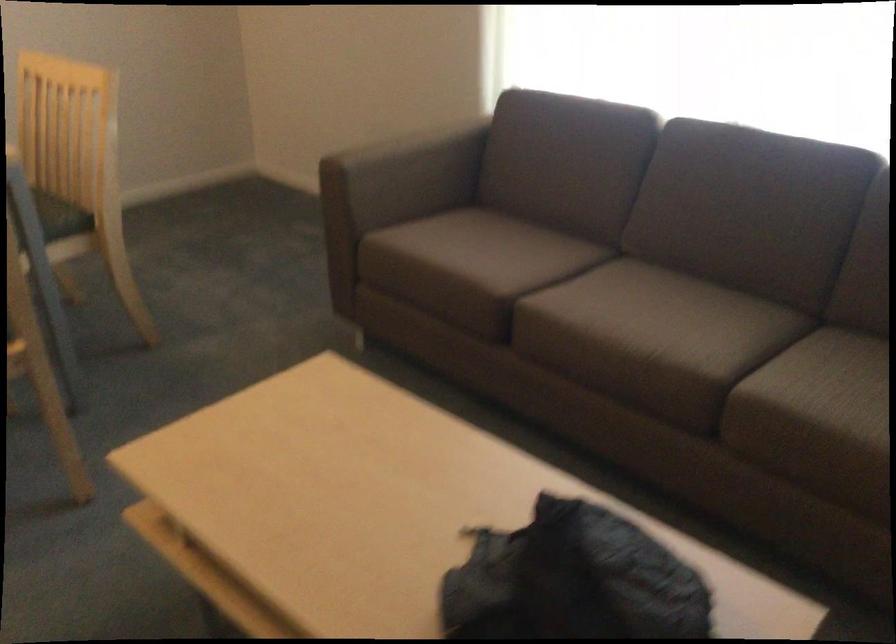
At what (x,y) coordinates should I click in order to perform the action: click on sofa armrest. Please return your answer as a coordinate pair (x, y). The image size is (896, 644). Looking at the image, I should click on (403, 176).